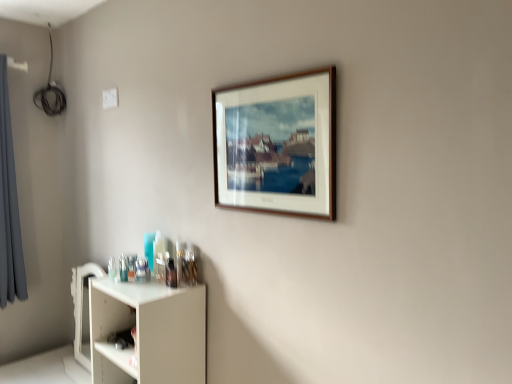
Question: Considering the relative sizes of white matte shelf at lower left and gray fabric curtain at left in the image provided, is white matte shelf at lower left smaller than gray fabric curtain at left?

Choices:
 (A) no
 (B) yes

Answer: (A)

Question: Is white matte shelf at lower left aimed at gray fabric curtain at left?

Choices:
 (A) no
 (B) yes

Answer: (A)

Question: From the image's perspective, is white matte shelf at lower left located beneath gray fabric curtain at left?

Choices:
 (A) yes
 (B) no

Answer: (A)

Question: Is white matte shelf at lower left bigger than gray fabric curtain at left?

Choices:
 (A) yes
 (B) no

Answer: (A)

Question: Is white matte shelf at lower left behind gray fabric curtain at left?

Choices:
 (A) no
 (B) yes

Answer: (A)

Question: From a real-world perspective, does white matte shelf at lower left stand above gray fabric curtain at left?

Choices:
 (A) yes
 (B) no

Answer: (B)

Question: Is gray fabric curtain at left not near wooden picture frame at upper center?

Choices:
 (A) no
 (B) yes

Answer: (B)

Question: From the image's perspective, is gray fabric curtain at left beneath wooden picture frame at upper center?

Choices:
 (A) yes
 (B) no

Answer: (A)

Question: Is the position of gray fabric curtain at left more distant than that of wooden picture frame at upper center?

Choices:
 (A) yes
 (B) no

Answer: (A)

Question: Can you confirm if gray fabric curtain at left is taller than wooden picture frame at upper center?

Choices:
 (A) yes
 (B) no

Answer: (A)

Question: Does gray fabric curtain at left appear on the right side of wooden picture frame at upper center?

Choices:
 (A) yes
 (B) no

Answer: (B)

Question: Can you confirm if gray fabric curtain at left is bigger than wooden picture frame at upper center?

Choices:
 (A) yes
 (B) no

Answer: (A)

Question: From a real-world perspective, is white matte shelf at lower left physically above wooden picture frame at upper center?

Choices:
 (A) yes
 (B) no

Answer: (B)